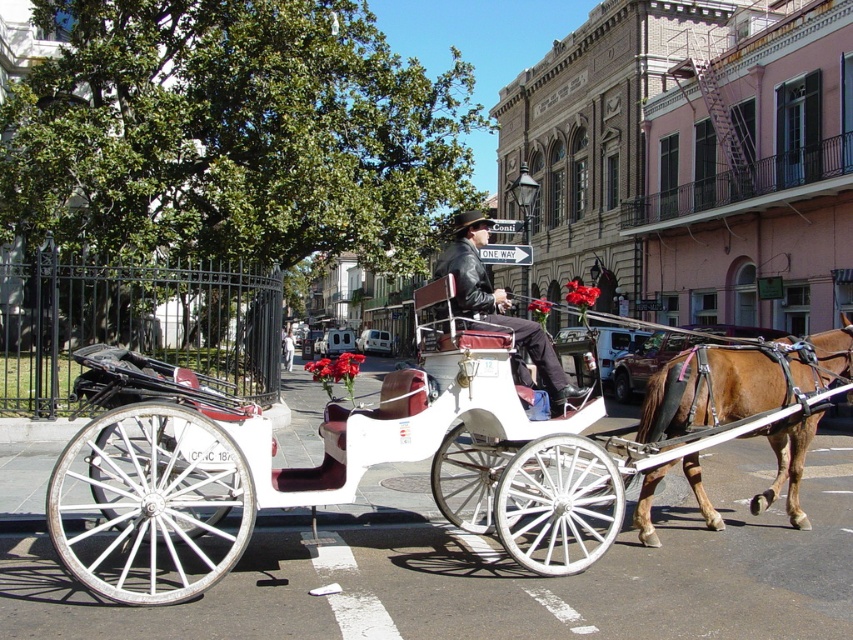
Does brown glossy horse at right have a greater width compared to leather jacket at center?

Yes.

Who is higher up, brown glossy horse at right or leather jacket at center?

leather jacket at center is above.

Is point (657, 540) closer to viewer compared to point (447, 252)?

That is False.

The height and width of the screenshot is (640, 853). In order to click on brown glossy horse at right in this screenshot , I will do `click(740, 381)`.

Is white polished wood cart at center wider than white fabric pants at center?

In fact, white polished wood cart at center might be narrower than white fabric pants at center.

Between point (639, 464) and point (287, 332), which one is positioned behind?

Point (287, 332)

At what (x,y) coordinates should I click in order to perform the action: click on white polished wood cart at center. Please return your answer as a coordinate pair (x, y). Image resolution: width=853 pixels, height=640 pixels. Looking at the image, I should click on (372, 461).

Is white polished wood cart at center below leather jacket at center?

Correct, white polished wood cart at center is located below leather jacket at center.

Is white polished wood cart at center thinner than leather jacket at center?

No.

This screenshot has height=640, width=853. I want to click on white polished wood cart at center, so click(x=372, y=461).

This screenshot has height=640, width=853. Find the location of `white polished wood cart at center`. white polished wood cart at center is located at coordinates (372, 461).